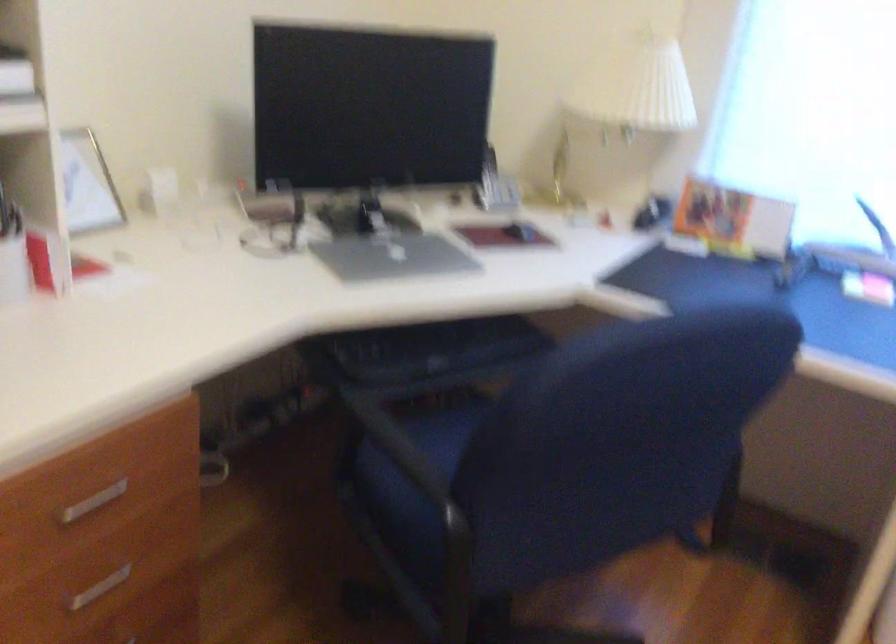
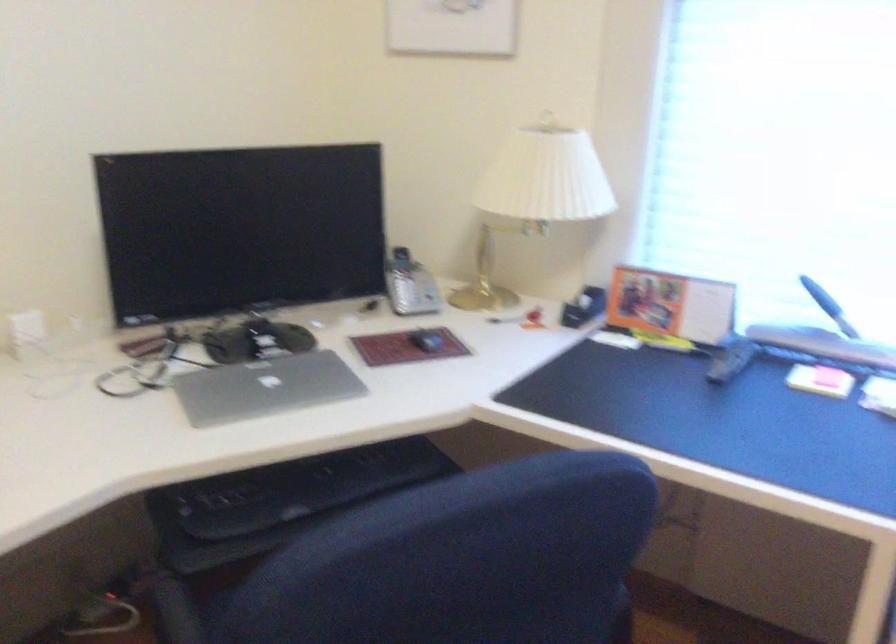
Find the pixel in the second image that matches [521,230] in the first image.

(426, 341)